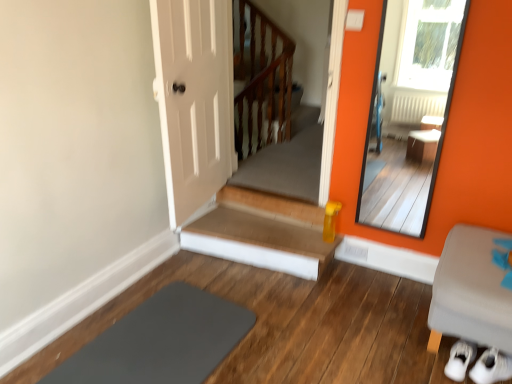
Question: Is wooden stairs at center thinner than slate at lower left?

Choices:
 (A) yes
 (B) no

Answer: (A)

Question: Is wooden stairs at center not close to slate at lower left?

Choices:
 (A) no
 (B) yes

Answer: (A)

Question: Is wooden stairs at center touching slate at lower left?

Choices:
 (A) no
 (B) yes

Answer: (A)

Question: Considering the relative positions of wooden stairs at center and slate at lower left in the image provided, is wooden stairs at center to the left of slate at lower left from the viewer's perspective?

Choices:
 (A) no
 (B) yes

Answer: (A)

Question: Can you confirm if wooden stairs at center is shorter than slate at lower left?

Choices:
 (A) no
 (B) yes

Answer: (A)

Question: Considering the positions of wooden stairs at center and wooden at upper center in the image, is wooden stairs at center taller or shorter than wooden at upper center?

Choices:
 (A) short
 (B) tall

Answer: (A)

Question: From the image's perspective, is wooden stairs at center located above or below wooden at upper center?

Choices:
 (A) below
 (B) above

Answer: (A)

Question: From a real-world perspective, is wooden stairs at center positioned above or below wooden at upper center?

Choices:
 (A) below
 (B) above

Answer: (A)

Question: Does point (282, 259) appear closer or farther from the camera than point (260, 122)?

Choices:
 (A) farther
 (B) closer

Answer: (B)

Question: Is wooden at upper center in front of or behind gray fabric ottoman at lower right in the image?

Choices:
 (A) front
 (B) behind

Answer: (B)

Question: In terms of width, does wooden at upper center look wider or thinner when compared to gray fabric ottoman at lower right?

Choices:
 (A) wide
 (B) thin

Answer: (B)

Question: Considering the relative positions of wooden at upper center and gray fabric ottoman at lower right in the image provided, is wooden at upper center to the left or to the right of gray fabric ottoman at lower right?

Choices:
 (A) left
 (B) right

Answer: (A)

Question: From a real-world perspective, relative to gray fabric ottoman at lower right, is wooden at upper center vertically above or below?

Choices:
 (A) below
 (B) above

Answer: (B)

Question: Is smooth orange mirror at right taller or shorter than wooden stairs at center?

Choices:
 (A) tall
 (B) short

Answer: (A)

Question: From the image's perspective, is smooth orange mirror at right positioned above or below wooden stairs at center?

Choices:
 (A) above
 (B) below

Answer: (A)